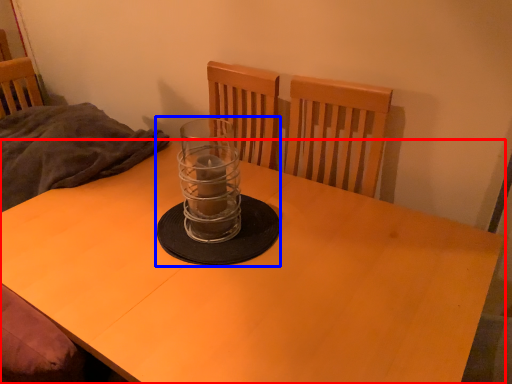
Question: Which object is closer to the camera taking this photo, desk (highlighted by a red box) or candle holder (highlighted by a blue box)?

Choices:
 (A) desk
 (B) candle holder

Answer: (A)